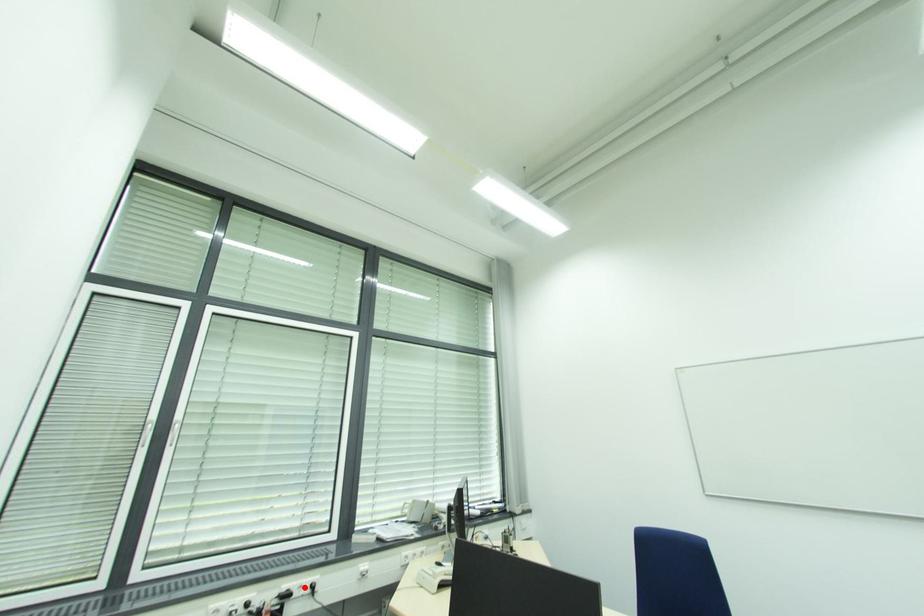
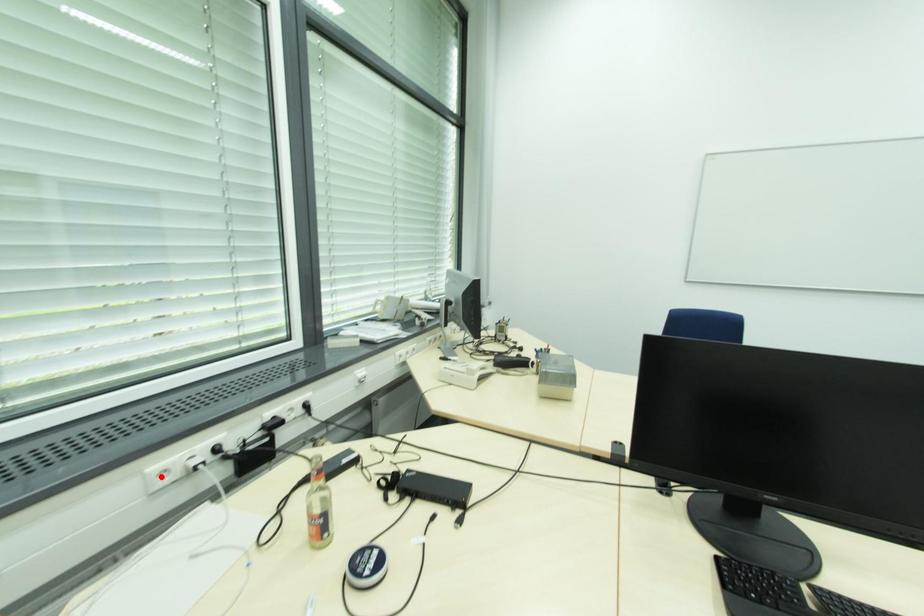
I am providing you with two images of the same scene from different viewpoints. A red point is marked on the first image and another point is marked on the second image. Does the point marked in image1 correspond to the same location as the one in image2?

No